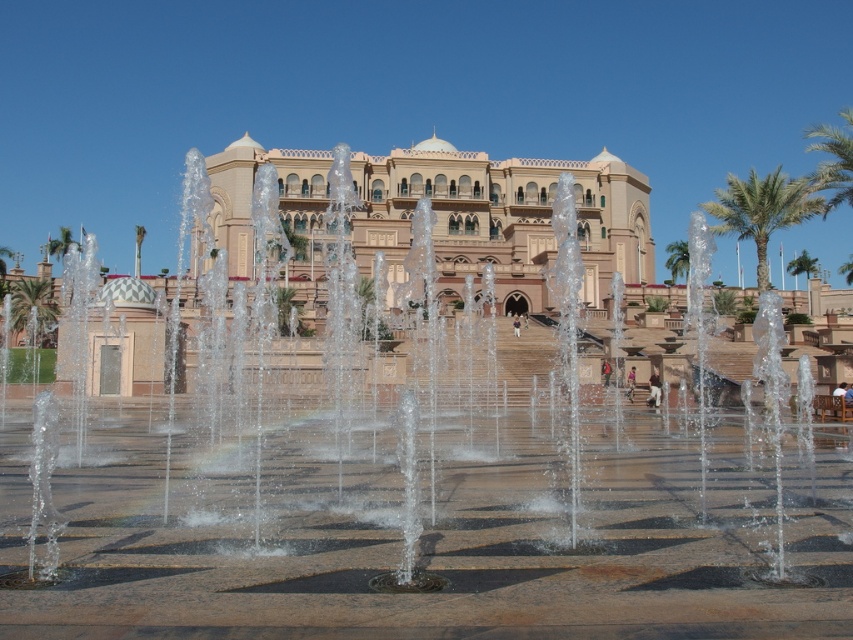
Where is `green leafy palm tree at right`? The image size is (853, 640). green leafy palm tree at right is located at coordinates (761, 211).

Consider the image. Who is more forward, (793, 220) or (12, 298)?

Positioned in front is point (793, 220).

Locate an element on the screen. This screenshot has height=640, width=853. green leafy palm tree at right is located at coordinates (761, 211).

Does clear water jets at center have a larger size compared to green leafy palm tree at upper right?

Indeed, clear water jets at center has a larger size compared to green leafy palm tree at upper right.

Is point (640, 291) positioned in front of point (838, 113)?

Yes, it is in front of point (838, 113).

Locate an element on the screen. The width and height of the screenshot is (853, 640). clear water jets at center is located at coordinates (408, 422).

Is clear water jets at center closer to the viewer compared to green leafy palm tree at right?

Yes, clear water jets at center is closer to the viewer.

Identify the location of clear water jets at center. (408, 422).